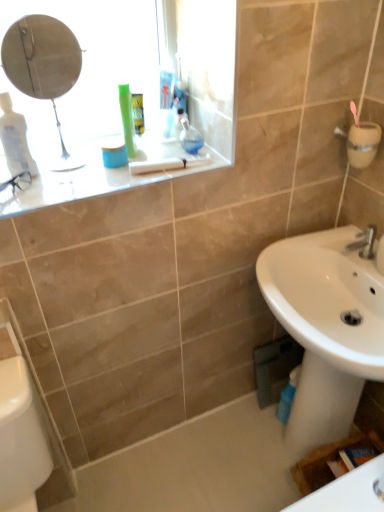
The height and width of the screenshot is (512, 384). I want to click on vacant area situated to the left side of silver metallic faucet at lower right, so click(x=323, y=250).